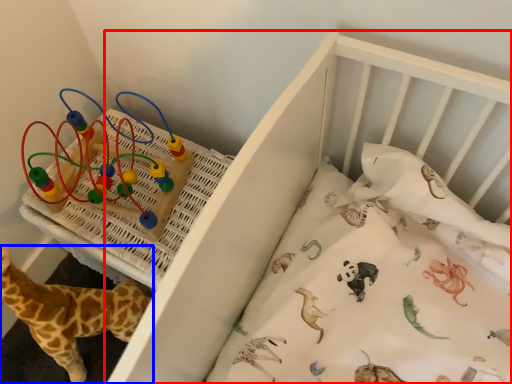
Question: Which object is closer to the camera taking this photo, infant bed (highlighted by a red box) or giraffe (highlighted by a blue box)?

Choices:
 (A) infant bed
 (B) giraffe

Answer: (A)